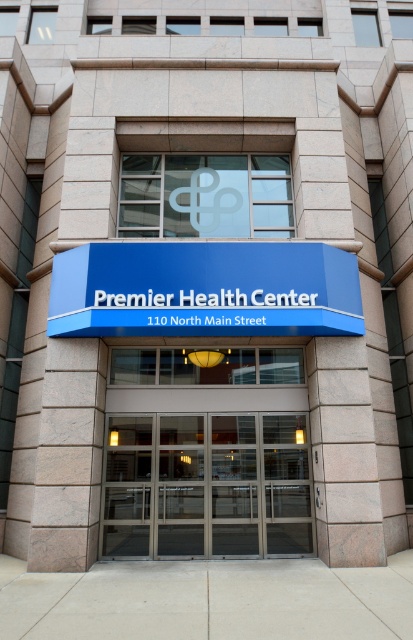
You are a delivery person arriving at the Premier Health Center. You need to enter through the entrance. Which object should you approach first, the metallic glass doors at center or the blue plastic sign at center?

The metallic glass doors at center is positioned on the right side of the blue plastic sign at center. Since you need to enter through the entrance, you should approach the metallic glass doors at center first as they are the entrance point.